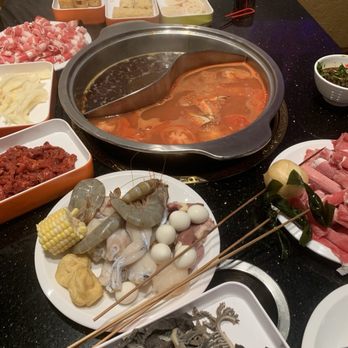
Identify the location of orange dish. (33, 194), (3, 128), (94, 13), (110, 20).